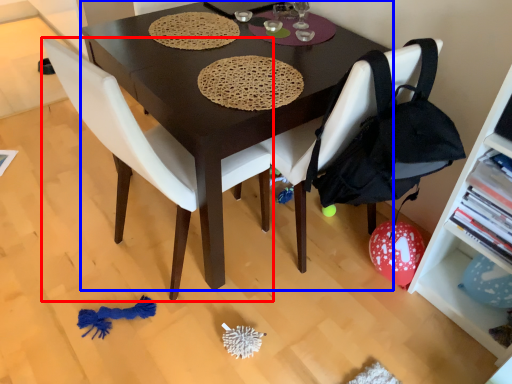
Question: Which object appears farthest to the camera in this image, chair (highlighted by a red box) or desk (highlighted by a blue box)?

Choices:
 (A) chair
 (B) desk

Answer: (B)